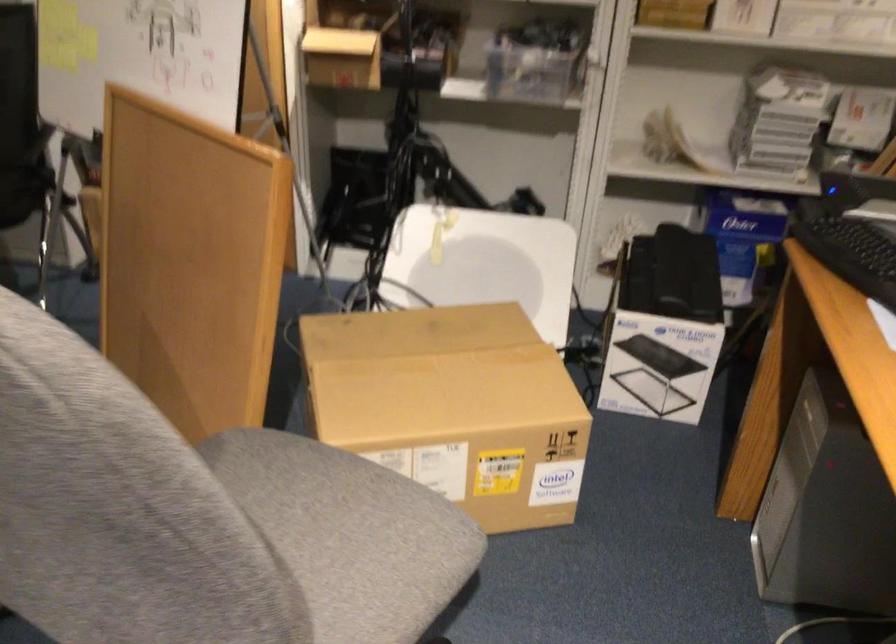
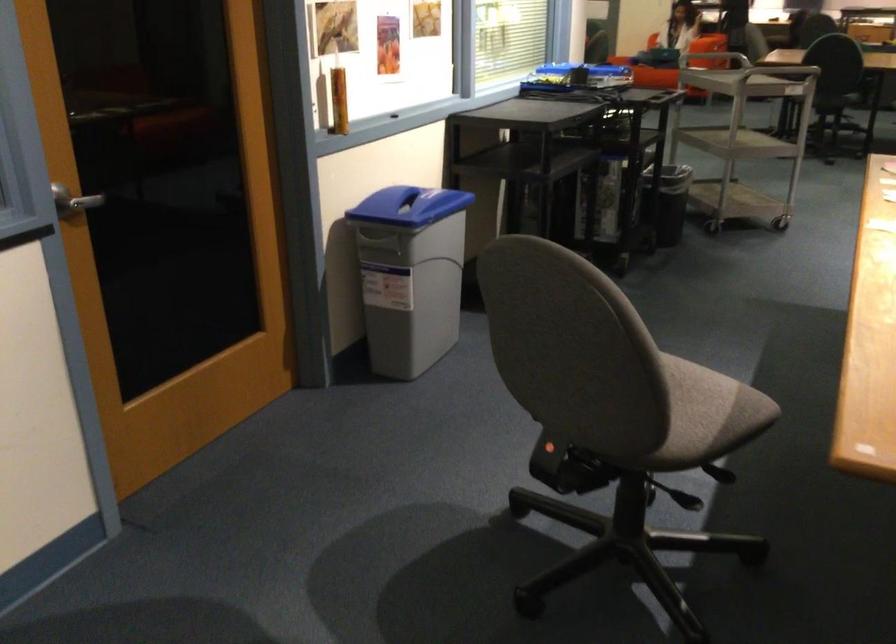
The first image is from the beginning of the video and the second image is from the end. How did the camera likely rotate when shooting the video?

The rotation direction of the camera is left-down.